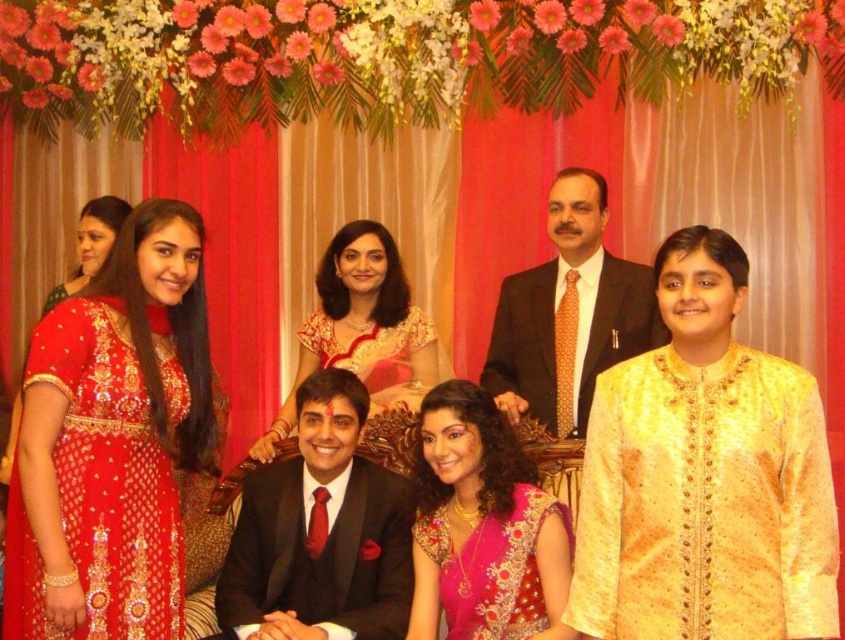
You are standing in front of the group of seven people in traditional attire. There is a point marked at coordinates (483, 528). Which object does this point correspond to?

The point at coordinates (483, 528) corresponds to the pink embroidered saree at center.

You are a photographer at the event and want to capture a shot that includes both the shiny black suit at center and the pink embroidered saree at center. Which one should you focus on first if you want to ensure both are in frame?

The shiny black suit at center is positioned on the left side of pink embroidered saree at center, so focusing on the pink embroidered saree at center first would allow you to frame both objects since it is on the right side.

You are standing in front of the image and want to locate the shiny black suit at center. Can you tell me its 2D coordinates based on the image?

The shiny black suit at center is located at the 2D coordinates of point (320, 532).